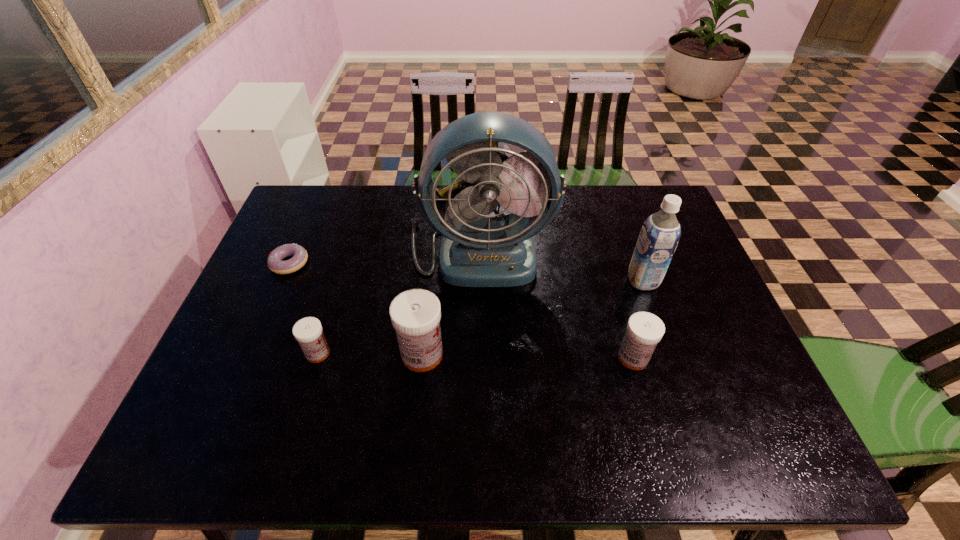
Identify the location of object located at the left edge. (274, 261).

You are a GUI agent. You are given a task and a screenshot of the screen. Output one action in this format:
    pyautogui.click(x=<x>, y=<y>)
    Task: Click on the object located in the right edge section of the desktop
    The width and height of the screenshot is (960, 540).
    Given the screenshot: What is the action you would take?
    pyautogui.click(x=659, y=236)

Locate an element on the screen. free location at the far edge is located at coordinates (563, 221).

This screenshot has height=540, width=960. Find the location of `vacant space at the near edge of the desktop`. vacant space at the near edge of the desktop is located at coordinates (576, 409).

Identify the location of blank space at the left edge. (252, 282).

The width and height of the screenshot is (960, 540). Find the location of `blank space at the far right corner of the desktop`. blank space at the far right corner of the desktop is located at coordinates (624, 186).

Locate an element on the screen. vacant region at the near right corner of the desktop is located at coordinates (753, 383).

Find the location of a particular element. The image size is (960, 540). empty space between the tallest medicine and the soya milk is located at coordinates (533, 318).

Locate an element on the screen. Image resolution: width=960 pixels, height=540 pixels. empty space that is in between the second medicine from right to left and the shortest medicine is located at coordinates (371, 354).

At what (x,y) coordinates should I click in order to perform the action: click on empty space between the doughnut and the tallest object. Please return your answer as a coordinate pair (x, y). The width and height of the screenshot is (960, 540). Looking at the image, I should click on (384, 256).